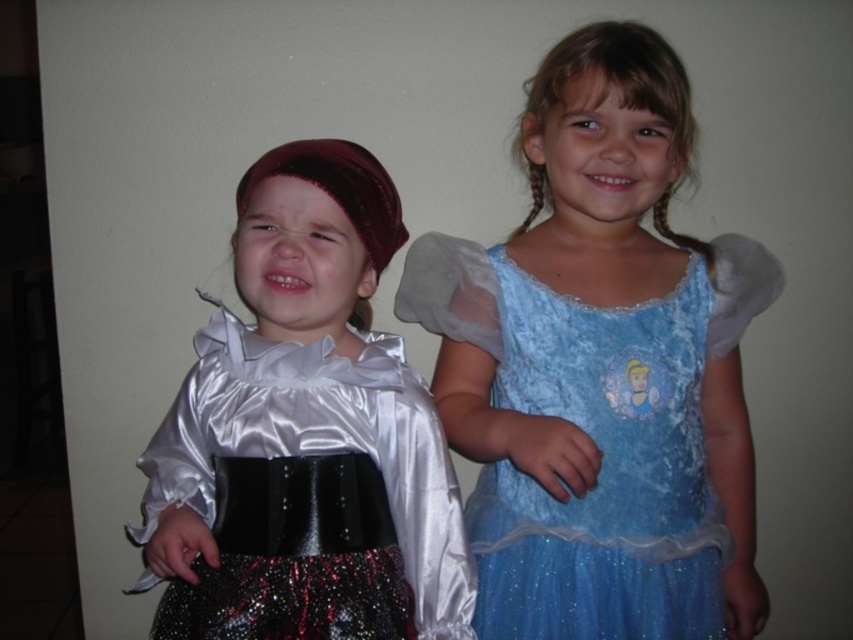
Does blue velvet dress at center have a greater height compared to satin dress at left?

Correct, blue velvet dress at center is much taller as satin dress at left.

Does blue velvet dress at center appear under satin dress at left?

No.

At what (x,y) coordinates should I click in order to perform the action: click on blue velvet dress at center. Please return your answer as a coordinate pair (x, y). The width and height of the screenshot is (853, 640). Looking at the image, I should click on (601, 369).

You are a GUI agent. You are given a task and a screenshot of the screen. Output one action in this format:
    pyautogui.click(x=<x>, y=<y>)
    Task: Click on the blue velvet dress at center
    
    Given the screenshot: What is the action you would take?
    pyautogui.click(x=601, y=369)